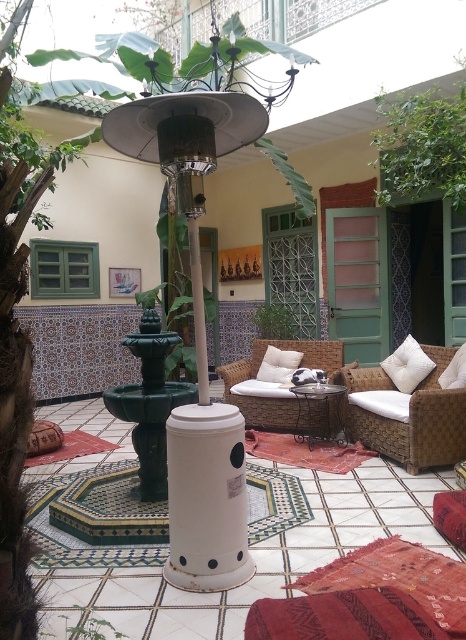
Question: Which point is closer to the camera?

Choices:
 (A) pyautogui.click(x=290, y=342)
 (B) pyautogui.click(x=198, y=568)

Answer: (B)

Question: Where is green leafy plant at upper right located in relation to green leafy plant at center in the image?

Choices:
 (A) above
 (B) below

Answer: (A)

Question: Observing the image, what is the correct spatial positioning of woven rattan armchair at center in reference to white wicker armchair at center?

Choices:
 (A) left
 (B) right

Answer: (B)

Question: Among these points, which one is farthest from the camera?

Choices:
 (A) (289, 364)
 (B) (348, 561)
 (C) (424, 362)

Answer: (A)

Question: Is white wicker armchair at center smaller than white soft cushion at center?

Choices:
 (A) yes
 (B) no

Answer: (B)

Question: Which is farther from the green leafy plant at center?

Choices:
 (A) green leafy plant at upper right
 (B) velvet red rug at lower right

Answer: (B)